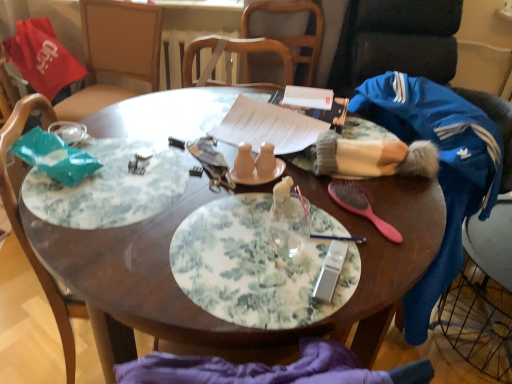
Question: Are matte ceramic salt and pepper shakers at center, acting as the 5th tableware starting from the right, and blue fleece jacket at right making contact?

Choices:
 (A) no
 (B) yes

Answer: (A)

Question: Can you confirm if matte ceramic salt and pepper shakers at center, acting as the 5th tableware starting from the right, is taller than blue fleece jacket at right?

Choices:
 (A) yes
 (B) no

Answer: (B)

Question: From the image's perspective, does matte ceramic salt and pepper shakers at center, which is the first tableware in left-to-right order, appear higher than blue fleece jacket at right?

Choices:
 (A) yes
 (B) no

Answer: (A)

Question: Is blue fleece jacket at right inside matte ceramic salt and pepper shakers at center, which is the first tableware in left-to-right order?

Choices:
 (A) no
 (B) yes

Answer: (A)

Question: Is matte ceramic salt and pepper shakers at center, which is the first tableware in left-to-right order, oriented away from blue fleece jacket at right?

Choices:
 (A) no
 (B) yes

Answer: (A)

Question: Can you confirm if matte ceramic salt and pepper shakers at center, which is the first tableware in left-to-right order, is smaller than blue fleece jacket at right?

Choices:
 (A) yes
 (B) no

Answer: (A)

Question: Does wooden chair at upper center, marked as the 1th chair in a right-to-left arrangement, have a greater width compared to pink plastic hairbrush at center-right, the first tableware positioned from the right?

Choices:
 (A) no
 (B) yes

Answer: (B)

Question: Is wooden chair at upper center, which appears as the 2th chair when viewed from the front, not near pink plastic hairbrush at center-right, the first tableware positioned from the right?

Choices:
 (A) yes
 (B) no

Answer: (A)

Question: From the image's perspective, does wooden chair at upper center, acting as the second chair starting from the bottom, appear higher than pink plastic hairbrush at center-right, which is the fifth tableware from left to right?

Choices:
 (A) yes
 (B) no

Answer: (A)

Question: Considering the relative positions of wooden chair at upper center, which ranks as the first chair in top-to-bottom order, and pink plastic hairbrush at center-right, which is the fifth tableware from left to right, in the image provided, is wooden chair at upper center, which ranks as the first chair in top-to-bottom order, to the left of pink plastic hairbrush at center-right, which is the fifth tableware from left to right, from the viewer's perspective?

Choices:
 (A) yes
 (B) no

Answer: (A)

Question: Is wooden chair at upper center, arranged as the first chair when viewed from the back, not inside pink plastic hairbrush at center-right, the first tableware positioned from the right?

Choices:
 (A) yes
 (B) no

Answer: (A)

Question: Does wooden chair at upper center, placed as the 2th chair when sorted from left to right, appear on the right side of pink plastic hairbrush at center-right, which is the fifth tableware from left to right?

Choices:
 (A) no
 (B) yes

Answer: (A)

Question: Considering the relative sizes of matte ceramic salt and pepper shakers at center, acting as the 4th tableware starting from the right, and floral-patterned plate at center in the image provided, is matte ceramic salt and pepper shakers at center, acting as the 4th tableware starting from the right, wider than floral-patterned plate at center?

Choices:
 (A) no
 (B) yes

Answer: (A)